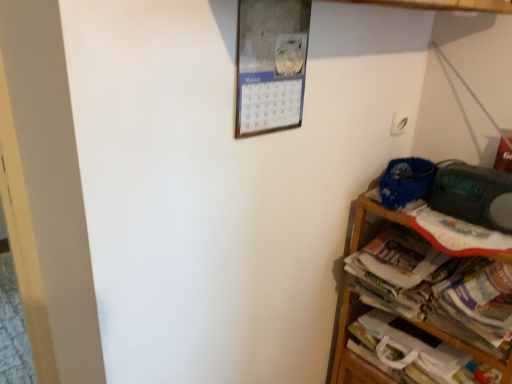
Question: Is white paper book at lower right to the left or to the right of white paper magazine at right in the image?

Choices:
 (A) right
 (B) left

Answer: (A)

Question: In the image, is white paper book at lower right positioned in front of or behind white paper magazine at right?

Choices:
 (A) front
 (B) behind

Answer: (A)

Question: Estimate the real-world distances between objects in this image. Which object is closer to the white paper magazine at right?

Choices:
 (A) white paper book at lower right
 (B) wooden shelf at right

Answer: (A)

Question: Which object is the farthest from the white paper book at lower right?

Choices:
 (A) white paper magazine at right
 (B) wooden shelf at right

Answer: (A)